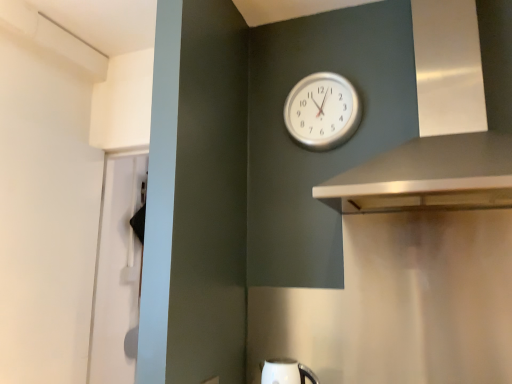
Question: Is silver metallic vent at upper right to the right of white glossy kettle at lower center from the viewer's perspective?

Choices:
 (A) yes
 (B) no

Answer: (A)

Question: From the image's perspective, is silver metallic vent at upper right located above white glossy kettle at lower center?

Choices:
 (A) yes
 (B) no

Answer: (A)

Question: Does silver metallic vent at upper right have a lesser height compared to white glossy kettle at lower center?

Choices:
 (A) yes
 (B) no

Answer: (B)

Question: Is silver metallic vent at upper right wider than white glossy kettle at lower center?

Choices:
 (A) no
 (B) yes

Answer: (B)

Question: Would you say silver metallic vent at upper right is outside white glossy kettle at lower center?

Choices:
 (A) yes
 (B) no

Answer: (A)

Question: In terms of height, does white glossy kettle at lower center look taller or shorter compared to silver metallic vent at upper right?

Choices:
 (A) short
 (B) tall

Answer: (A)

Question: Considering the positions of white glossy kettle at lower center and silver metallic vent at upper right in the image, is white glossy kettle at lower center bigger or smaller than silver metallic vent at upper right?

Choices:
 (A) big
 (B) small

Answer: (B)

Question: Based on their positions, is white glossy kettle at lower center located to the left or right of silver metallic vent at upper right?

Choices:
 (A) right
 (B) left

Answer: (B)

Question: Is point (283, 374) closer or farther from the camera than point (464, 190)?

Choices:
 (A) farther
 (B) closer

Answer: (A)

Question: Is silver metallic clock at upper center wider or thinner than silver metallic vent at upper right?

Choices:
 (A) wide
 (B) thin

Answer: (B)

Question: Is silver metallic clock at upper center inside or outside of silver metallic vent at upper right?

Choices:
 (A) outside
 (B) inside

Answer: (A)

Question: Considering their positions, is silver metallic clock at upper center located in front of or behind silver metallic vent at upper right?

Choices:
 (A) front
 (B) behind

Answer: (B)

Question: From the image's perspective, is silver metallic clock at upper center above or below silver metallic vent at upper right?

Choices:
 (A) above
 (B) below

Answer: (B)

Question: Visually, is silver metallic vent at upper right positioned to the left or to the right of silver metallic clock at upper center?

Choices:
 (A) left
 (B) right

Answer: (B)

Question: Considering their positions, is silver metallic vent at upper right located in front of or behind silver metallic clock at upper center?

Choices:
 (A) front
 (B) behind

Answer: (A)